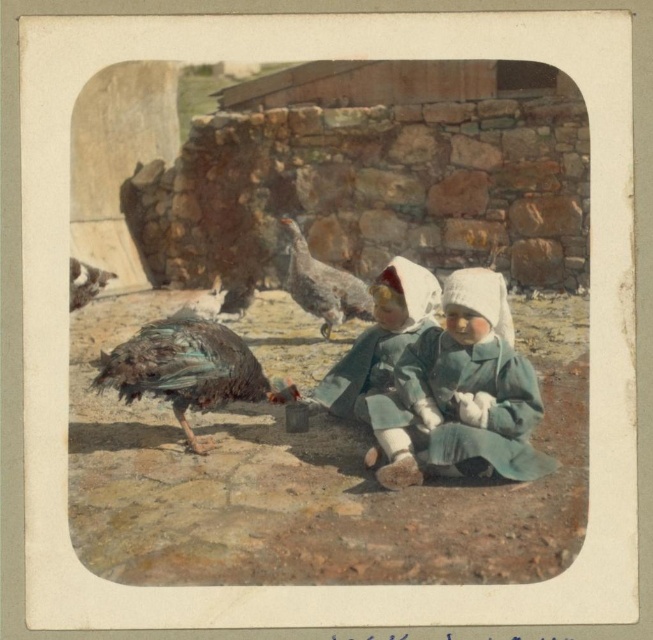
From the picture: Can you confirm if matte green dress at center is wider than gray feathered turkey at center?

Yes.

Consider the image. Does matte green dress at center appear over gray feathered turkey at center?

No, matte green dress at center is not above gray feathered turkey at center.

Is point (389, 284) farther from camera compared to point (291, 240)?

No.

I want to click on matte green dress at center, so click(x=374, y=346).

Is multicolored feathered bird at center in front of brown speckled feather at upper left?

Yes, it is in front of brown speckled feather at upper left.

Does multicolored feathered bird at center have a greater height compared to brown speckled feather at upper left?

Yes, multicolored feathered bird at center is taller than brown speckled feather at upper left.

What do you see at coordinates (187, 371) in the screenshot? I see `multicolored feathered bird at center` at bounding box center [187, 371].

Locate an element on the screen. multicolored feathered bird at center is located at coordinates (187, 371).

Does gray feathered turkey at center appear on the left side of brown speckled feather at upper left?

No, gray feathered turkey at center is not to the left of brown speckled feather at upper left.

Who is more forward, (326,339) or (84,292)?

Point (84,292) is in front.

Which is in front, point (326, 280) or point (82, 269)?

Point (82, 269) is more forward.

Find the location of a particular element. The height and width of the screenshot is (640, 653). gray feathered turkey at center is located at coordinates (323, 285).